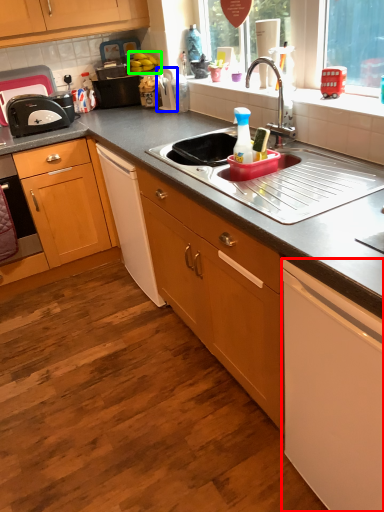
Question: Which object is positioned farthest from cabinetry (highlighted by a red box)? Select from appliance (highlighted by a blue box) and fruit (highlighted by a green box).

Choices:
 (A) appliance
 (B) fruit

Answer: (B)